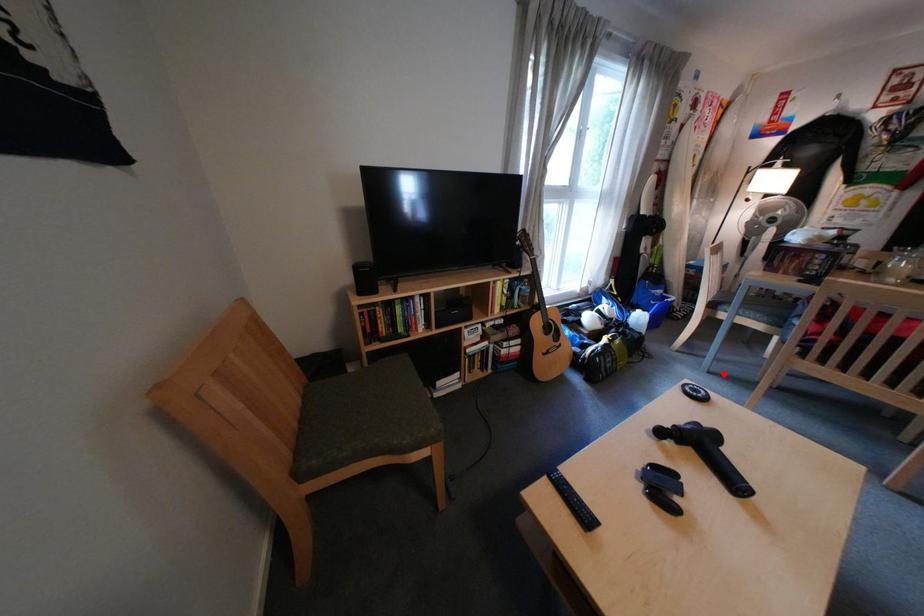
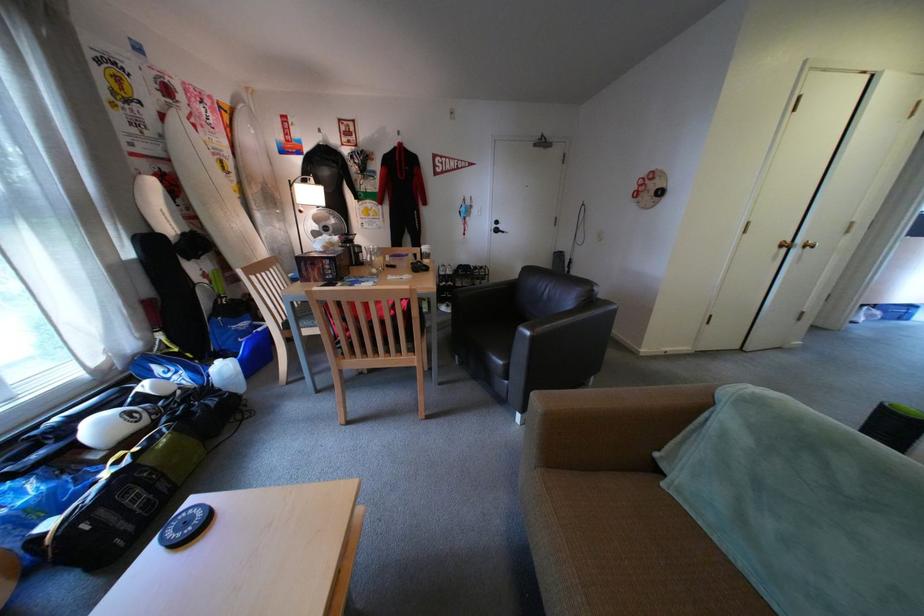
Question: I am providing you with two images of the same scene from different viewpoints. Image1 has a red point marked. In image2, the corresponding 3D location appears at what relative position? Reply with the corresponding letter.

Choices:
 (A) Closer
 (B) Farther

Answer: (A)